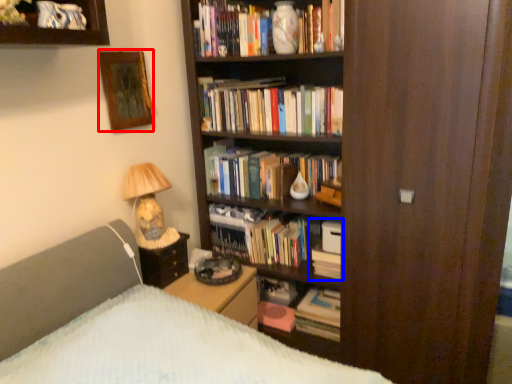
Question: Which of the following is the farthest to the observer, picture frame (highlighted by a red box) or book (highlighted by a blue box)?

Choices:
 (A) picture frame
 (B) book

Answer: (B)